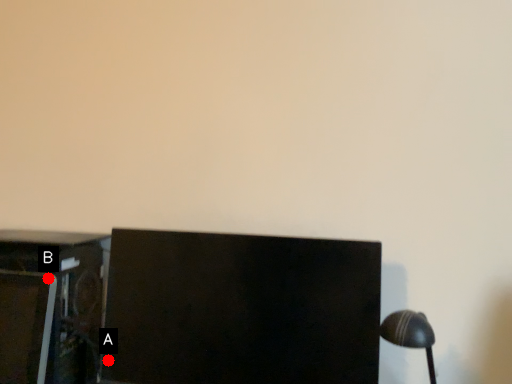
Question: Two points are circled on the image, labeled by A and B beside each circle. Which of the following is the farthest from the observer?

Choices:
 (A) A is further
 (B) B is further

Answer: (A)